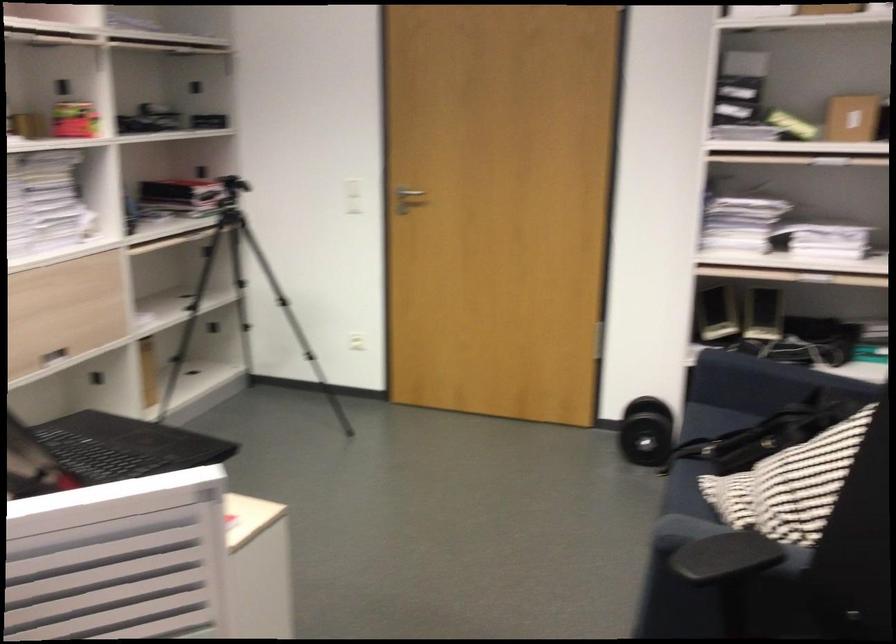
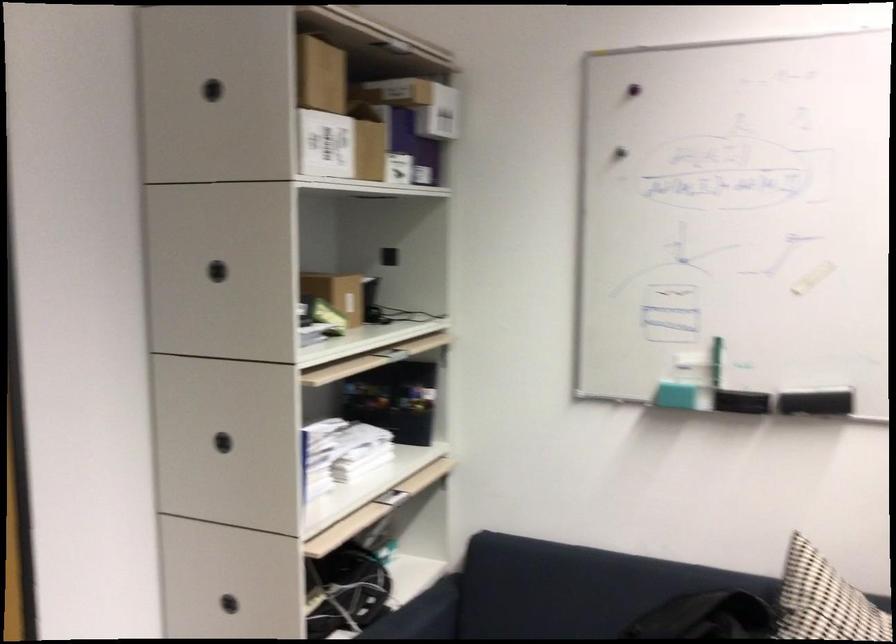
Locate, in the second image, the point that corresponds to the point at 733,82 in the first image.

(217, 270)